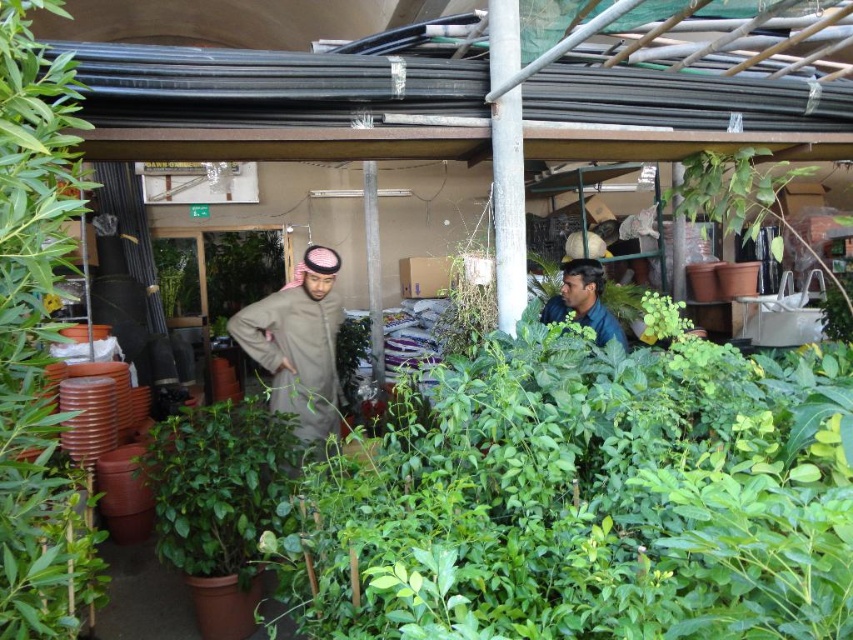
Question: Is light brown fabric trench coat at center in front of dark blue shirt at center?

Choices:
 (A) no
 (B) yes

Answer: (B)

Question: Which object appears closest to the camera in this image?

Choices:
 (A) light brown fabric trench coat at center
 (B) dark blue shirt at center

Answer: (A)

Question: Is the position of light brown fabric trench coat at center less distant than that of dark blue shirt at center?

Choices:
 (A) no
 (B) yes

Answer: (B)

Question: Can you confirm if light brown fabric trench coat at center is wider than dark blue shirt at center?

Choices:
 (A) no
 (B) yes

Answer: (B)